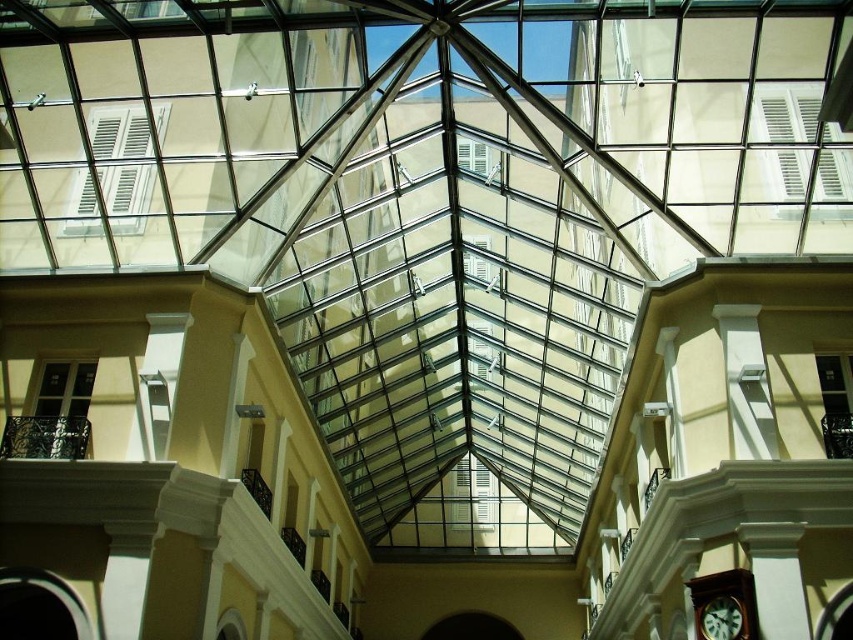
Question: Does brown wooden clock at lower right lie behind green matte clock at lower right?

Choices:
 (A) yes
 (B) no

Answer: (B)

Question: Is brown wooden clock at lower right to the right of green matte clock at lower right from the viewer's perspective?

Choices:
 (A) yes
 (B) no

Answer: (A)

Question: Is brown wooden clock at lower right below green matte clock at lower right?

Choices:
 (A) yes
 (B) no

Answer: (B)